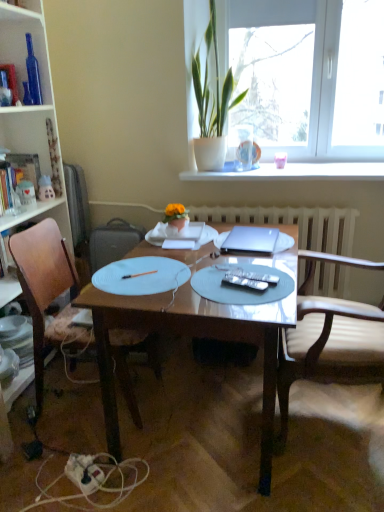
This screenshot has height=512, width=384. I want to click on vacant area that is situated to the right of white matte paper plate at center, the first paper plate in the left-to-right sequence, so click(228, 272).